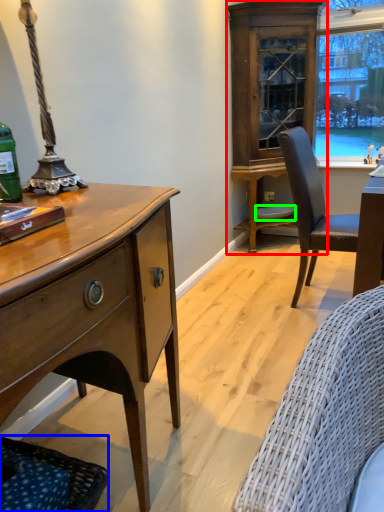
Question: Which object is the farthest from cabinetry (highlighted by a red box)? Choose among these: studio couch (highlighted by a blue box) or plate (highlighted by a green box).

Choices:
 (A) studio couch
 (B) plate

Answer: (A)